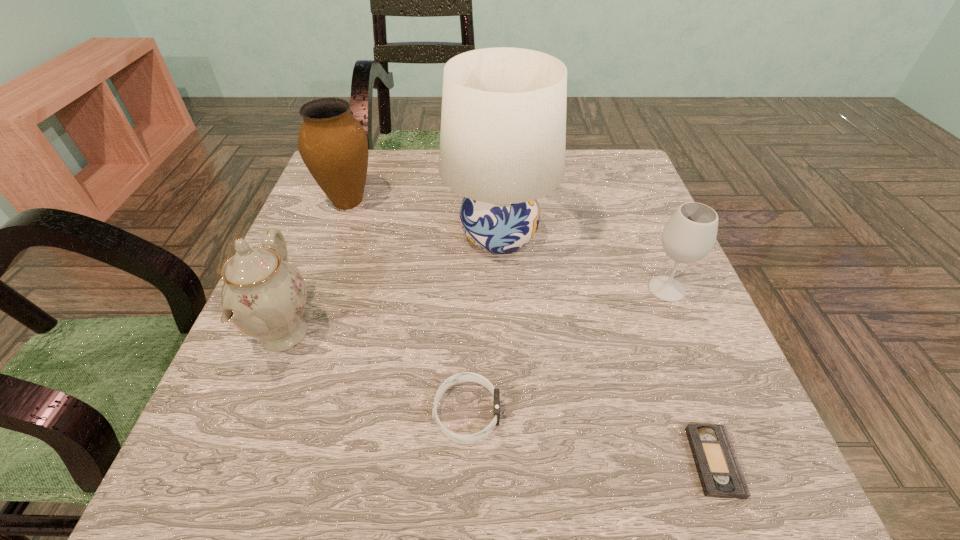
This screenshot has height=540, width=960. In order to click on the tallest object in this screenshot , I will do click(x=503, y=123).

What are the coordinates of `urn` in the screenshot? It's located at (333, 145).

Locate an element on the screen. chinaware is located at coordinates (263, 295).

Image resolution: width=960 pixels, height=540 pixels. What are the coordinates of `the fourth tallest object` in the screenshot? It's located at (689, 235).

Locate an element on the screen. The width and height of the screenshot is (960, 540). wristband is located at coordinates (464, 376).

Where is `videotape`? videotape is located at coordinates (719, 471).

Where is `vacant space located 0.120m on the front-facing side of the lampshade`? vacant space located 0.120m on the front-facing side of the lampshade is located at coordinates (390, 236).

Where is `free region located on the front-facing side of the lampshade`? This screenshot has width=960, height=540. free region located on the front-facing side of the lampshade is located at coordinates (358, 236).

Locate an element on the screen. This screenshot has height=540, width=960. vacant position located on the front-facing side of the lampshade is located at coordinates 381,236.

The image size is (960, 540). In order to click on vacant position located 0.180m on the right of the urn in this screenshot , I will do `click(452, 201)`.